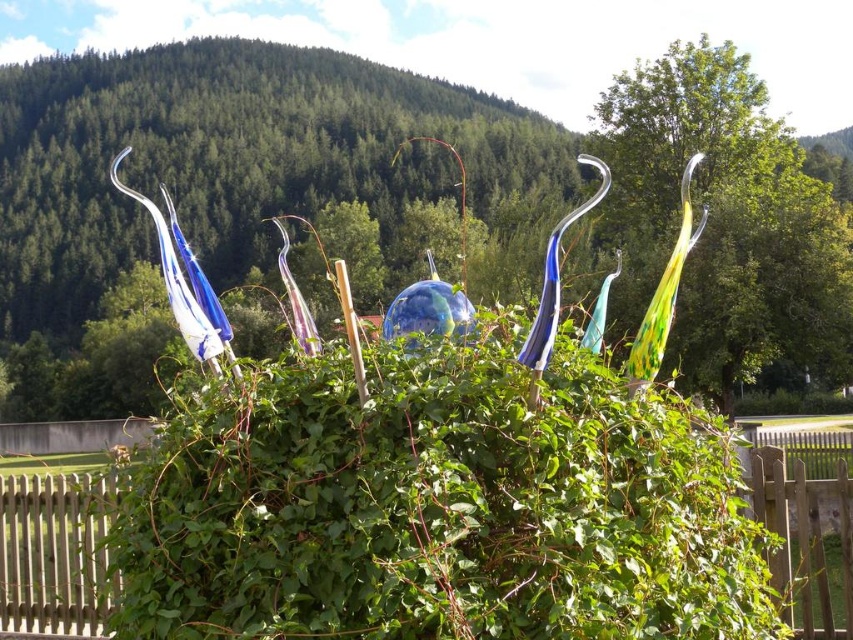
You are a gardener who wants to trim the green leafy bush at center and the wooden fence at lower right. Which object is covering the other one?

The green leafy bush at center is positioned over the wooden fence at lower right, so it is covering the fence.

You are a gardener planning to install a new fence section between the white wooden fence at lower left and the wooden fence at lower right. Which fence should you use as a reference for height to ensure consistency?

The white wooden fence at lower left is not as tall as the wooden fence at lower right, so you should use the wooden fence at lower right as the reference for height to maintain consistency.